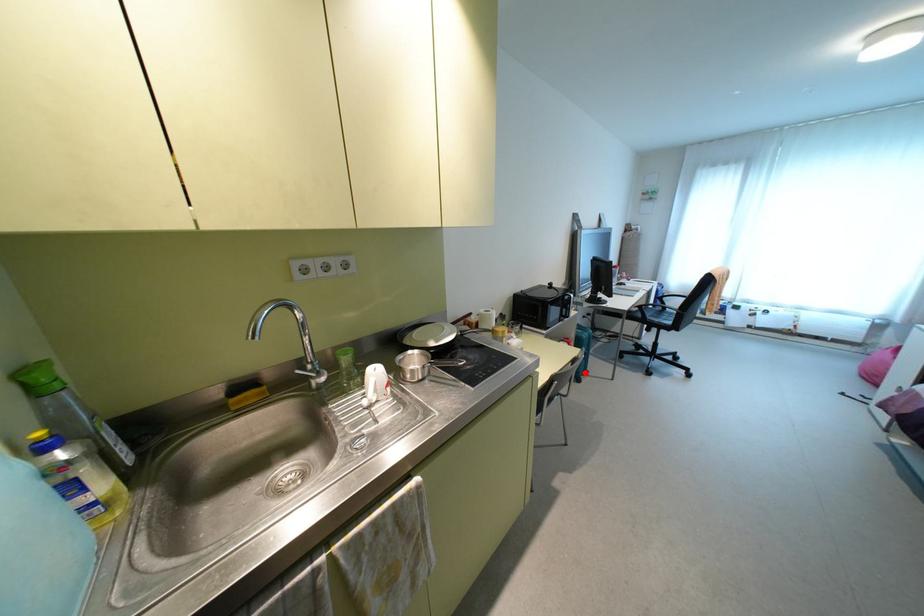
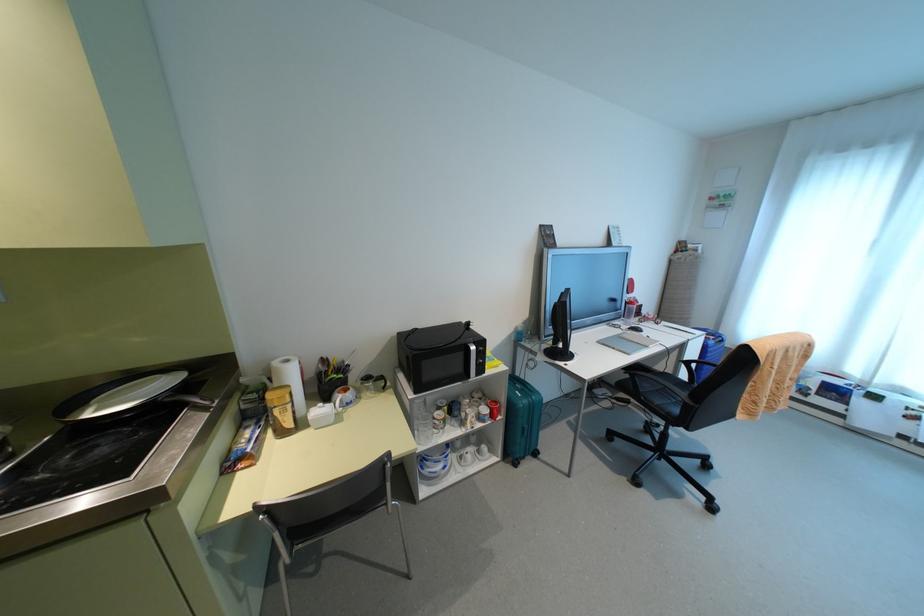
The point at the highlighted location is marked in the first image. Where is the corresponding point in the second image?

(535, 454)